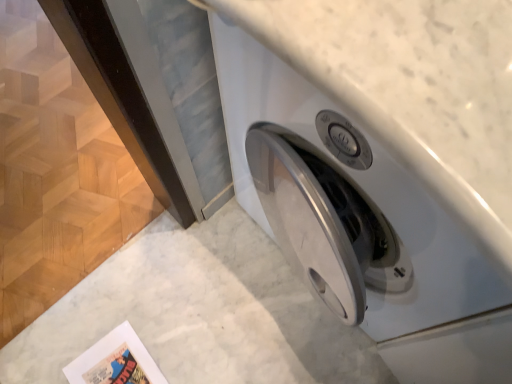
Describe the element at coordinates (362, 207) in the screenshot. I see `white glossy washing machine at center` at that location.

Find the location of a particular element. This screenshot has height=384, width=512. white glossy washing machine at center is located at coordinates (362, 207).

Locate an element on the screen. Image resolution: width=512 pixels, height=384 pixels. matte paper comic book at lower left is located at coordinates click(115, 361).

What do you see at coordinates (115, 361) in the screenshot? I see `matte paper comic book at lower left` at bounding box center [115, 361].

What is the approximate height of matte paper comic book at lower left?

The height of matte paper comic book at lower left is 1.15 inches.

Find the location of `white glossy washing machine at center`. white glossy washing machine at center is located at coordinates (362, 207).

Considering the relative positions of matte paper comic book at lower left and white glossy washing machine at center in the image provided, is matte paper comic book at lower left to the right of white glossy washing machine at center from the viewer's perspective?

No, matte paper comic book at lower left is not to the right of white glossy washing machine at center.

Considering the relative positions of matte paper comic book at lower left and white glossy washing machine at center in the image provided, is matte paper comic book at lower left in front of white glossy washing machine at center?

No, it is not.

Considering the positions of points (73, 368) and (468, 314), is point (73, 368) closer to camera compared to point (468, 314)?

No, (73, 368) is behind (468, 314).

Based on the photo, from the image's perspective, is matte paper comic book at lower left located above white glossy washing machine at center?

Incorrect, from the image's perspective, matte paper comic book at lower left is lower than white glossy washing machine at center.

From a real-world perspective, which object rests below the other?

matte paper comic book at lower left.

Does matte paper comic book at lower left have a lesser width compared to white glossy washing machine at center?

Yes, matte paper comic book at lower left is thinner than white glossy washing machine at center.

Considering the sizes of matte paper comic book at lower left and white glossy washing machine at center in the image, is matte paper comic book at lower left taller or shorter than white glossy washing machine at center?

Clearly, matte paper comic book at lower left is shorter compared to white glossy washing machine at center.

Which of these two, matte paper comic book at lower left or white glossy washing machine at center, is smaller?

matte paper comic book at lower left.

Would you say matte paper comic book at lower left is outside white glossy washing machine at center?

Yes.

Are matte paper comic book at lower left and white glossy washing machine at center far apart?

No, there isn't a large distance between matte paper comic book at lower left and white glossy washing machine at center.

Is matte paper comic book at lower left facing away from white glossy washing machine at center?

No, matte paper comic book at lower left's orientation is not away from white glossy washing machine at center.

Locate an element on the screen. washing machine on the right of matte paper comic book at lower left is located at coordinates (362, 207).

Which is more to the right, white glossy washing machine at center or matte paper comic book at lower left?

white glossy washing machine at center.

Which is behind, white glossy washing machine at center or matte paper comic book at lower left?

matte paper comic book at lower left.

Considering the positions of point (397, 280) and point (99, 365), is point (397, 280) closer or farther from the camera than point (99, 365)?

Point (397, 280) appears to be closer to the viewer than point (99, 365).

From the image's perspective, is white glossy washing machine at center beneath matte paper comic book at lower left?

No, from the image's perspective, white glossy washing machine at center is not below matte paper comic book at lower left.

From a real-world perspective, is white glossy washing machine at center physically above matte paper comic book at lower left?

Indeed, from a real-world perspective, white glossy washing machine at center stands above matte paper comic book at lower left.

Is white glossy washing machine at center thinner than matte paper comic book at lower left?

No, white glossy washing machine at center is not thinner than matte paper comic book at lower left.

Between white glossy washing machine at center and matte paper comic book at lower left, which one has more height?

With more height is white glossy washing machine at center.

Based on the photo, who is bigger, white glossy washing machine at center or matte paper comic book at lower left?

Bigger between the two is white glossy washing machine at center.

Consider the image. Is white glossy washing machine at center outside of matte paper comic book at lower left?

Yes.

Is white glossy washing machine at center not close to matte paper comic book at lower left?

No, white glossy washing machine at center is in close proximity to matte paper comic book at lower left.

Is white glossy washing machine at center positioned with its back to matte paper comic book at lower left?

white glossy washing machine at center is not turned away from matte paper comic book at lower left.

I want to click on washing machine on the right of matte paper comic book at lower left, so [x=362, y=207].

The image size is (512, 384). Identify the location of washing machine above the matte paper comic book at lower left (from the image's perspective). (362, 207).

Where is `comic book behind the white glossy washing machine at center`? The image size is (512, 384). comic book behind the white glossy washing machine at center is located at coordinates (115, 361).